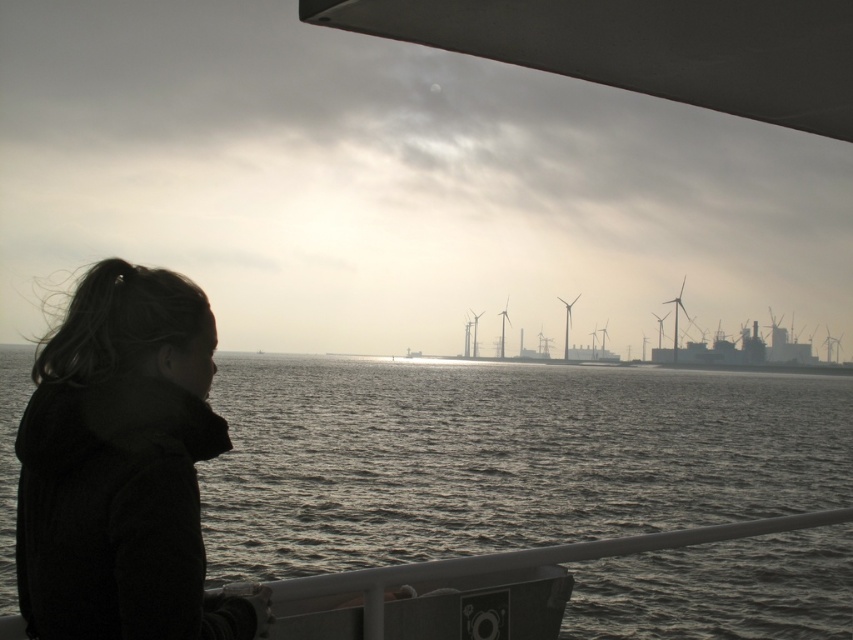
Question: Among these objects, which one is farthest from the camera?

Choices:
 (A) dark woolen jacket at left
 (B) gray matte water at lower center

Answer: (B)

Question: Which object is closer to the camera taking this photo?

Choices:
 (A) dark woolen jacket at left
 (B) gray matte water at lower center

Answer: (A)

Question: Which point is closer to the camera taking this photo?

Choices:
 (A) (784, 540)
 (B) (62, 417)

Answer: (B)

Question: Is gray matte water at lower center further to camera compared to dark woolen jacket at left?

Choices:
 (A) no
 (B) yes

Answer: (B)

Question: Considering the relative positions of gray matte water at lower center and dark woolen jacket at left in the image provided, where is gray matte water at lower center located with respect to dark woolen jacket at left?

Choices:
 (A) right
 (B) left

Answer: (B)

Question: Is gray matte water at lower center wider than dark woolen jacket at left?

Choices:
 (A) no
 (B) yes

Answer: (B)